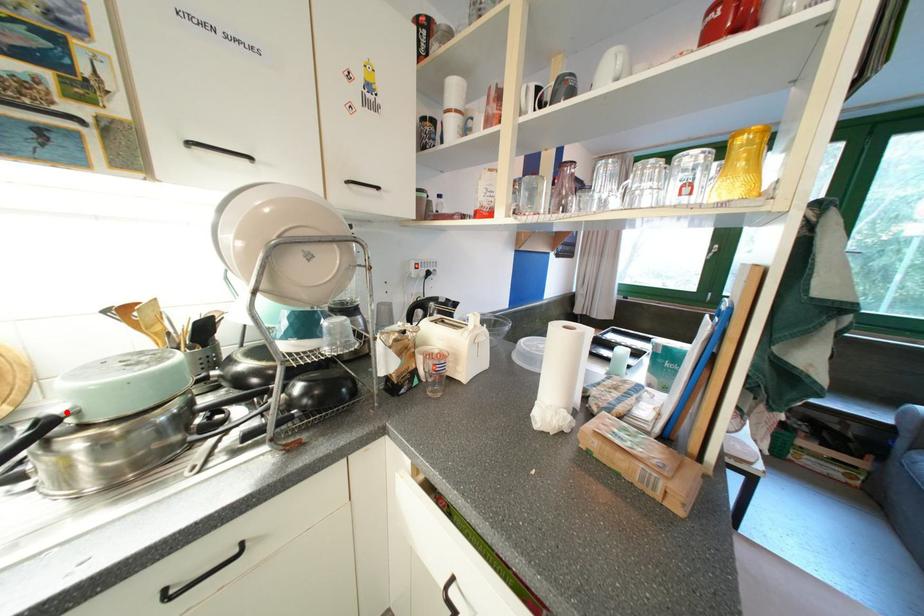
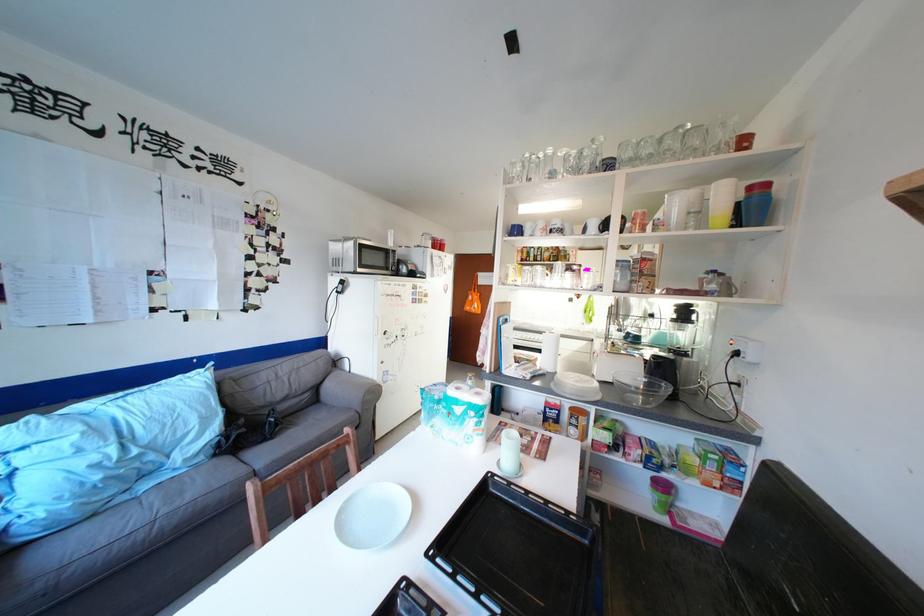
Question: I am providing you with two images of the same scene from different viewpoints. A red point is marked on the first image. Is the red point's position out of view in image 2?

Choices:
 (A) Yes
 (B) No

Answer: (A)